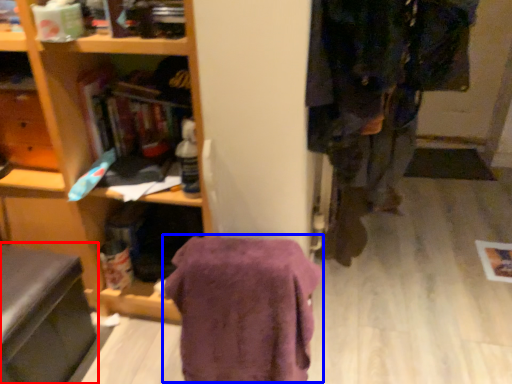
Question: Among these objects, which one is farthest to the camera, swivel chair (highlighted by a red box) or blanket (highlighted by a blue box)?

Choices:
 (A) swivel chair
 (B) blanket

Answer: (A)